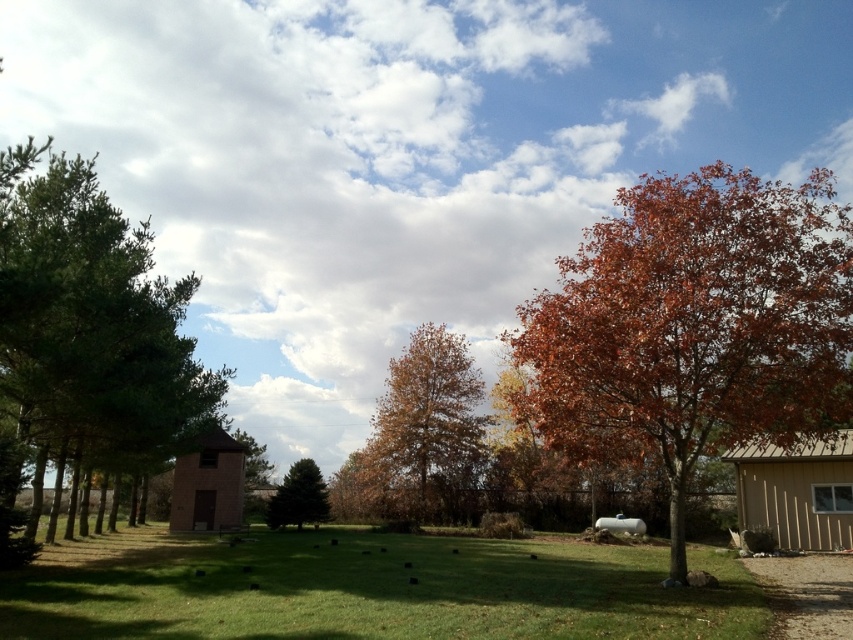
Question: Considering the relative positions of green grass at center and green matte evergreen tree at center in the image provided, where is green grass at center located with respect to green matte evergreen tree at center?

Choices:
 (A) right
 (B) left

Answer: (A)

Question: Which object is positioned farthest from the green matte evergreen tree at center?

Choices:
 (A) green grass at center
 (B) green leafy tree at left
 (C) autumn leaves tree at right
 (D) brown textured tree at center

Answer: (C)

Question: Does green leafy tree at left have a lesser width compared to brown textured tree at center?

Choices:
 (A) yes
 (B) no

Answer: (B)

Question: Is autumn leaves tree at right thinner than green matte evergreen tree at center?

Choices:
 (A) yes
 (B) no

Answer: (B)

Question: Among these objects, which one is nearest to the camera?

Choices:
 (A) brown textured tree at center
 (B) green leafy tree at left
 (C) autumn leaves tree at right
 (D) green matte evergreen tree at center

Answer: (C)

Question: Considering the real-world distances, which object is closest to the green matte evergreen tree at center?

Choices:
 (A) green leafy tree at left
 (B) autumn leaves tree at right
 (C) green grass at center
 (D) brown textured tree at center

Answer: (D)